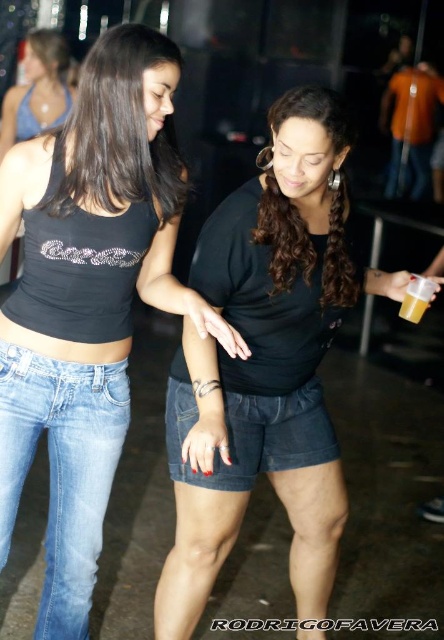
You are a photographer trying to capture a candid shot of the denim shorts at center without including the light blue denim jeans at lower left in the frame. Given their positions, is this possible?

The light blue denim jeans at lower left is in front of the denim shorts at center, so it would block the view. Therefore, you cannot capture the denim shorts at center without including the light blue denim jeans at lower left in the frame.

You are a fashion designer analyzing clothing sizes in the image. Given that the light blue denim jeans at lower left and the denim shorts at center are both for the same person, which clothing item would you recommend as a better fit for someone with a larger frame?

The light blue denim jeans at lower left is larger in size than the denim shorts at center, so it would be a better fit for someone with a larger frame.